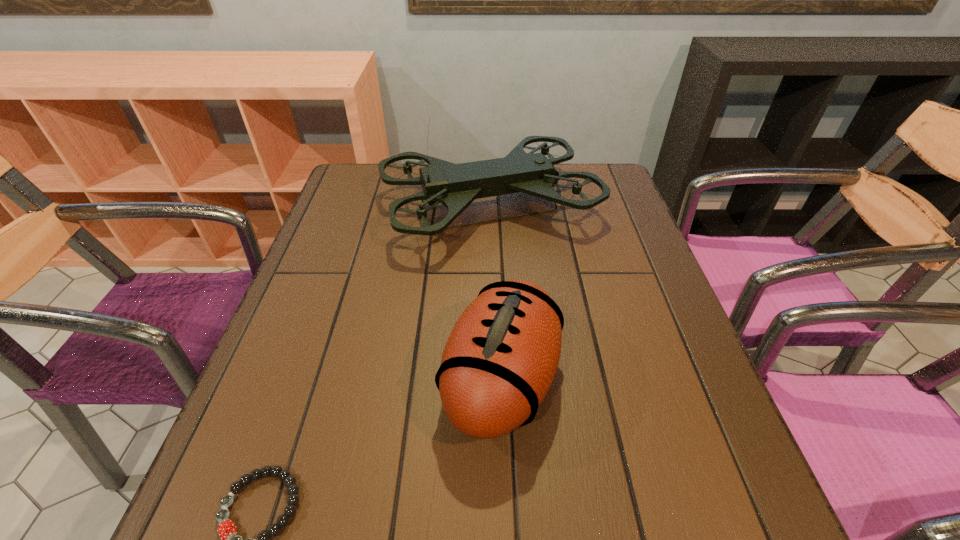
You are a GUI agent. You are given a task and a screenshot of the screen. Output one action in this format:
    pyautogui.click(x=<x>, y=<y>)
    Task: Click on the drone
    
    Given the screenshot: What is the action you would take?
    pyautogui.click(x=456, y=186)

The image size is (960, 540). Identify the location of the farthest object. (456, 186).

Where is `the second shortest object`? the second shortest object is located at coordinates (500, 359).

Identify the location of football (American). This screenshot has width=960, height=540. (500, 359).

The image size is (960, 540). I want to click on vacant point located 0.100m on the front of the drone, so tap(492, 294).

Where is `vacant space located 0.130m on the right of the second shortest object`? Image resolution: width=960 pixels, height=540 pixels. vacant space located 0.130m on the right of the second shortest object is located at coordinates (635, 381).

Find the location of a particular element. object that is at the far edge is located at coordinates (456, 186).

Locate an element on the screen. object present at the left edge is located at coordinates (456, 186).

You are a GUI agent. You are given a task and a screenshot of the screen. Output one action in this format:
    pyautogui.click(x=<x>, y=<y>)
    Task: Click on the object at the right edge
    Image resolution: width=960 pixels, height=540 pixels.
    Given the screenshot: What is the action you would take?
    pyautogui.click(x=456, y=186)

The width and height of the screenshot is (960, 540). In order to click on object present at the far left corner in this screenshot , I will do `click(456, 186)`.